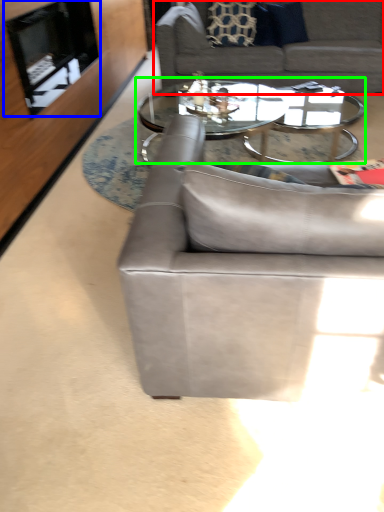
Question: Based on their relative distances, which object is nearer to studio couch (highlighted by a red box)? Choose from fireplace (highlighted by a blue box) and coffee table (highlighted by a green box).

Choices:
 (A) fireplace
 (B) coffee table

Answer: (B)